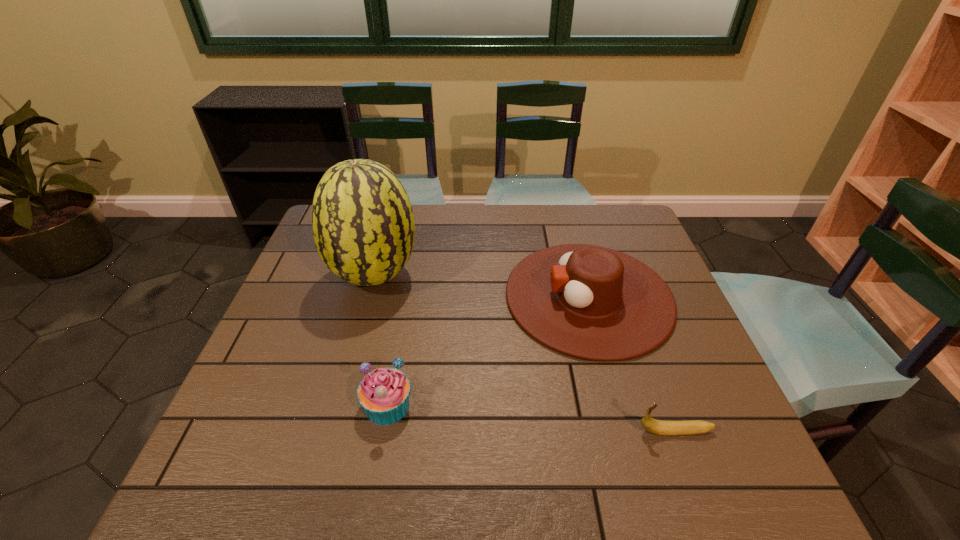
Where is `watermelon`? watermelon is located at coordinates (363, 226).

Locate an element on the screen. cowboy hat is located at coordinates (590, 302).

This screenshot has height=540, width=960. What are the coordinates of `muffin` in the screenshot? It's located at (384, 393).

You are a GUI agent. You are given a task and a screenshot of the screen. Output one action in this format:
    pyautogui.click(x=<x>, y=<y>)
    Task: Click on the shortest object
    Image resolution: width=960 pixels, height=540 pixels.
    Given the screenshot: What is the action you would take?
    pyautogui.click(x=659, y=427)

This screenshot has height=540, width=960. What are the coordinates of `vacant point located on the back of the tallest object` in the screenshot? It's located at coord(387,234).

Image resolution: width=960 pixels, height=540 pixels. Identify the location of vacant space located on the front-facing side of the cowboy hat. (432, 296).

You are a GUI agent. You are given a task and a screenshot of the screen. Output one action in this format:
    pyautogui.click(x=<x>, y=<y>)
    Task: Click on the free location located on the front-facing side of the cowboy hat
    
    Given the screenshot: What is the action you would take?
    pyautogui.click(x=380, y=296)

Identify the location of vacant space located 0.350m on the front-facing side of the cowboy hat. Image resolution: width=960 pixels, height=540 pixels. (376, 296).

Where is `vacant space situated on the right of the muffin`? The width and height of the screenshot is (960, 540). vacant space situated on the right of the muffin is located at coordinates coord(577,405).

At what (x,y) coordinates should I click in order to perform the action: click on vacant region located 0.240m at the stem of the banana. Please return your answer as a coordinate pair (x, y). The width and height of the screenshot is (960, 540). Looking at the image, I should click on (519, 431).